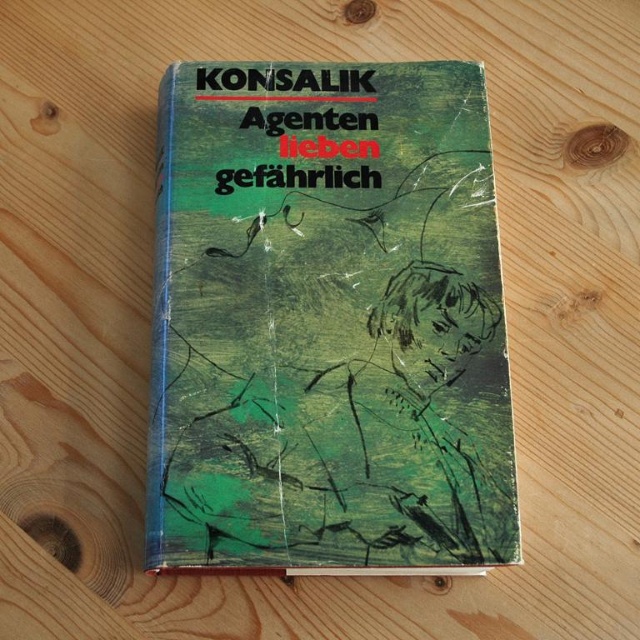
Can you confirm if green matte book at center is positioned below black paper title at upper center?

Yes, green matte book at center is below black paper title at upper center.

Measure the distance between green matte book at center and camera.

3.81 feet

Identify the location of green matte book at center. Image resolution: width=640 pixels, height=640 pixels. (328, 323).